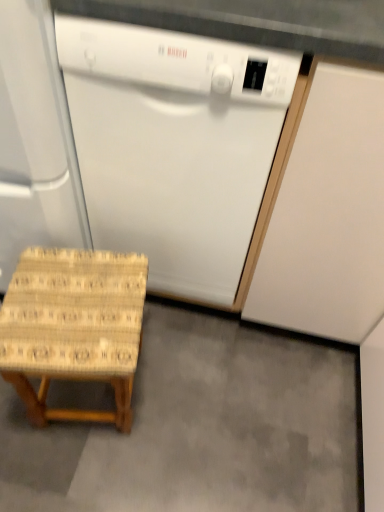
Question: Considering the positions of white glossy dishwasher at center and white matte cabinet at right in the image, is white glossy dishwasher at center bigger or smaller than white matte cabinet at right?

Choices:
 (A) small
 (B) big

Answer: (A)

Question: Which is correct: white glossy dishwasher at center is inside white matte cabinet at right, or outside of it?

Choices:
 (A) outside
 (B) inside

Answer: (A)

Question: Estimate the real-world distances between objects in this image. Which object is farther from the white matte cabinet at right?

Choices:
 (A) white glossy dishwasher at center
 (B) white matte dishwasher at left
 (C) woven wood stool at lower left
 (D) woven wood stool at lower left

Answer: (B)

Question: Based on their relative distances, which object is farther from the white matte cabinet at right?

Choices:
 (A) woven wood stool at lower left
 (B) woven wood stool at lower left
 (C) white glossy dishwasher at center
 (D) white matte dishwasher at left

Answer: (D)